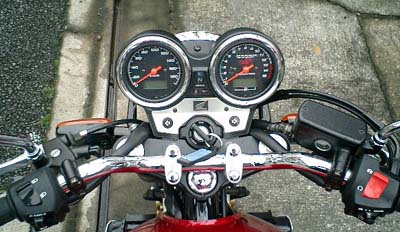
At what (x,y) coordinates should I click in order to perform the action: click on floor. Please return your answer as a coordinate pair (x, y). Looking at the image, I should click on (329, 62).